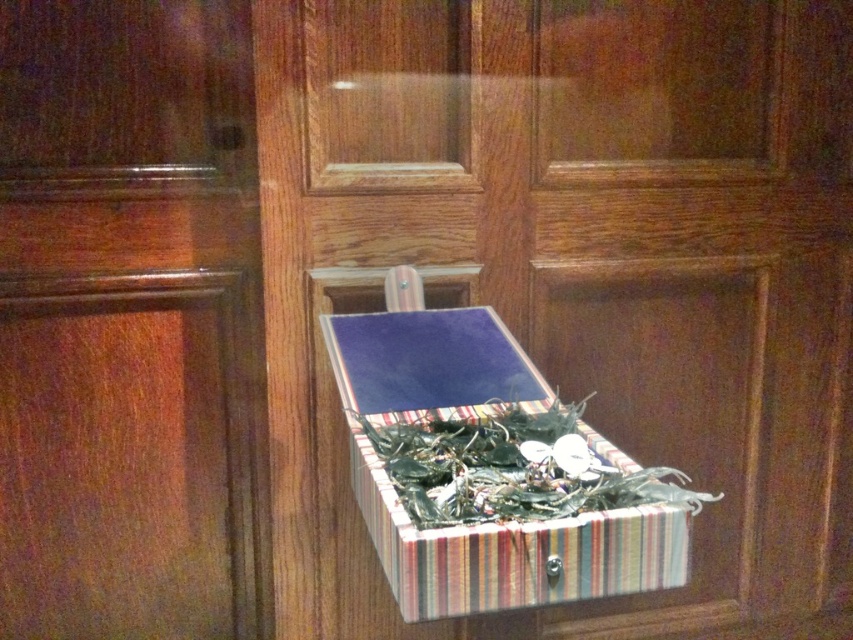
You are moving a wooden door at center and a glossy wood door at center through a doorway that is 1 meter wide. Which door can pass through without needing adjustment?

The glossy wood door at center can pass through the doorway without needing adjustment because its width is less than the wooden door at center, which is wider than 1 meter.

You are organizing items on a wooden surface with a vertical grain pattern. You have a wooden door at center and a glossy wood door at center. Which door should you move to the left side to align them properly?

You should move the wooden door at center to the left side because it is currently to the right of the glossy wood door at center, so moving it left would place it next to or beside the glossy wood door.

Consider the image. You are standing in front of a wooden surface with a box and Christmas lights. There is a point marked at coordinates (129, 323). What object is located at this point?

The point at coordinates (129, 323) corresponds to the glossy wood door at center.